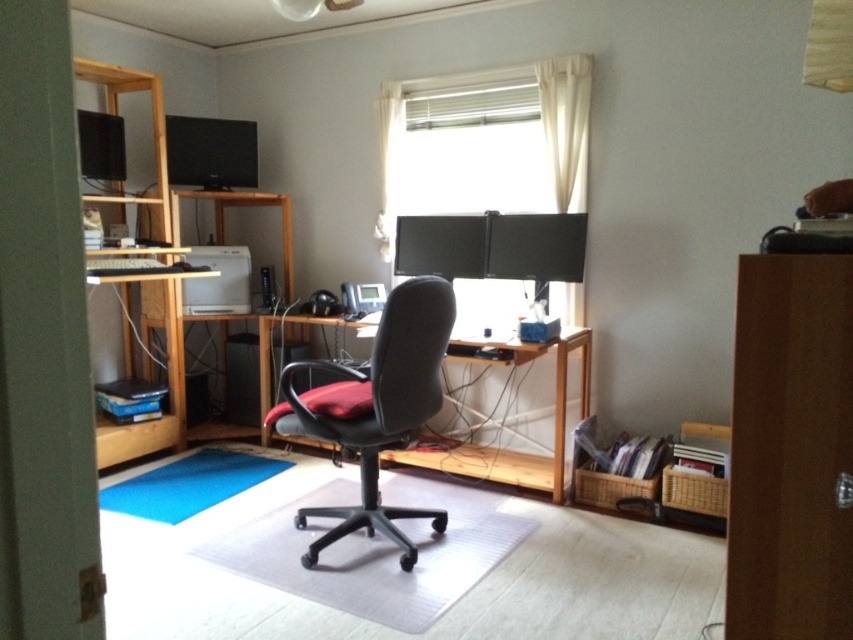
Does matte black swivel chair at center have a smaller size compared to wooden desk at center?

No.

Does point (434, 352) lie in front of point (457, 360)?

Yes, it is in front of point (457, 360).

Locate an element on the screen. matte black swivel chair at center is located at coordinates (381, 408).

Does blue carpet at lower left appear on the left side of satin black monitor at upper left?

No, blue carpet at lower left is not to the left of satin black monitor at upper left.

Is point (207, 490) farther from camera compared to point (222, 150)?

That is False.

Does point (204, 452) lie behind point (167, 161)?

No.

Locate an element on the screen. Image resolution: width=853 pixels, height=640 pixels. blue carpet at lower left is located at coordinates (189, 484).

Which is above, wooden bookshelf at left or satin black monitor at upper left?

satin black monitor at upper left is higher up.

The width and height of the screenshot is (853, 640). In order to click on wooden bookshelf at left in this screenshot , I will do `click(167, 381)`.